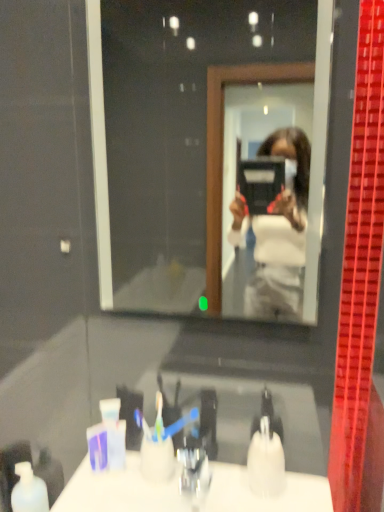
The height and width of the screenshot is (512, 384). In order to click on free space above white glossy counter top at lower center (from a real-world perspective) in this screenshot , I will do `click(168, 482)`.